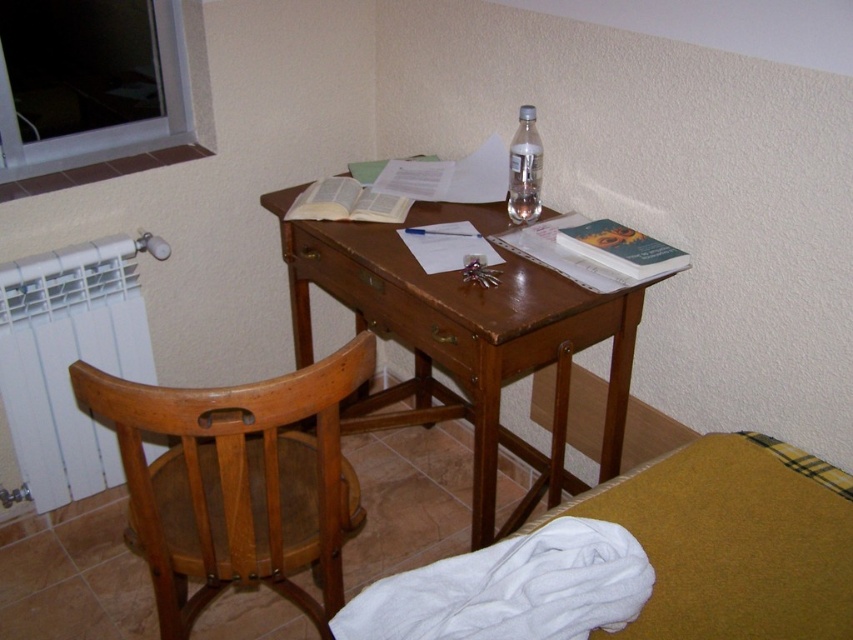
Question: Is wooden chair at left thinner than brown wood drawer at center?

Choices:
 (A) no
 (B) yes

Answer: (A)

Question: Does white plastic radiator at lower left come in front of clear glass bottle at center?

Choices:
 (A) yes
 (B) no

Answer: (B)

Question: Among these objects, which one is farthest from the camera?

Choices:
 (A) clear glass bottle at center
 (B) white fabric at lower right
 (C) brown wood drawer at center
 (D) wooden chair at left

Answer: (A)

Question: Is white plastic radiator at lower left to the right of brown wood drawer at center from the viewer's perspective?

Choices:
 (A) no
 (B) yes

Answer: (A)

Question: Which of the following is the closest to the observer?

Choices:
 (A) (242, 500)
 (B) (115, 364)

Answer: (A)

Question: Which point is closer to the camera?

Choices:
 (A) (363, 282)
 (B) (297, 278)

Answer: (A)